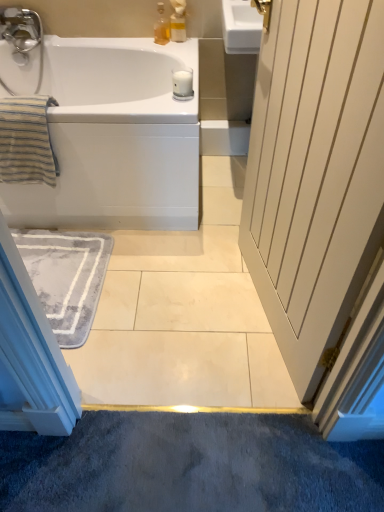
Question: Considering the positions of gray soft rug at lower left and translucent plastic bottle at upper center in the image, is gray soft rug at lower left bigger or smaller than translucent plastic bottle at upper center?

Choices:
 (A) small
 (B) big

Answer: (B)

Question: Is point (97, 261) positioned closer to the camera than point (168, 24)?

Choices:
 (A) farther
 (B) closer

Answer: (B)

Question: Based on their relative distances, which object is farther from the striped cotton towel at left?

Choices:
 (A) white glossy bathtub at upper left
 (B) translucent plastic bottle at upper center
 (C) gray soft rug at lower left
 (D) translucent plastic soap dispenser at upper center

Answer: (D)

Question: Estimate the real-world distances between objects in this image. Which object is closer to the translucent plastic bottle at upper center?

Choices:
 (A) gray soft rug at lower left
 (B) white glossy bathtub at upper left
 (C) translucent plastic soap dispenser at upper center
 (D) striped cotton towel at left

Answer: (C)